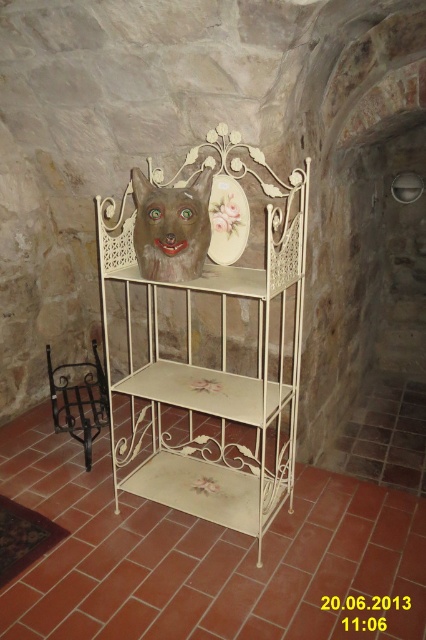
How far apart are white wrought iron shelf at center and white painted metal shelf at center?

white wrought iron shelf at center and white painted metal shelf at center are 22.28 inches apart.

Who is positioned more to the right, white wrought iron shelf at center or white painted metal shelf at center?

white painted metal shelf at center is more to the right.

Between point (198, 545) and point (294, 403), which one is positioned in front?

Positioned in front is point (198, 545).

Locate an element on the screen. white wrought iron shelf at center is located at coordinates (203, 556).

Who is taller, white wrought iron shelf at center or black wrought iron chair at left?

black wrought iron chair at left

Does white wrought iron shelf at center have a greater height compared to black wrought iron chair at left?

Incorrect, white wrought iron shelf at center's height is not larger of black wrought iron chair at left's.

Is point (37, 464) in front of point (92, 372)?

Yes.

The image size is (426, 640). Find the location of `white wrought iron shelf at center`. white wrought iron shelf at center is located at coordinates (203, 556).

How far apart are white painted metal shelf at center and matte ceramic mask at center?

They are 19.35 inches apart.

Which is below, white painted metal shelf at center or matte ceramic mask at center?

white painted metal shelf at center is lower down.

Between point (190, 348) and point (138, 218), which one is positioned in front?

Point (138, 218) is more forward.

Identify the location of white painted metal shelf at center. Image resolution: width=426 pixels, height=640 pixels. (219, 348).